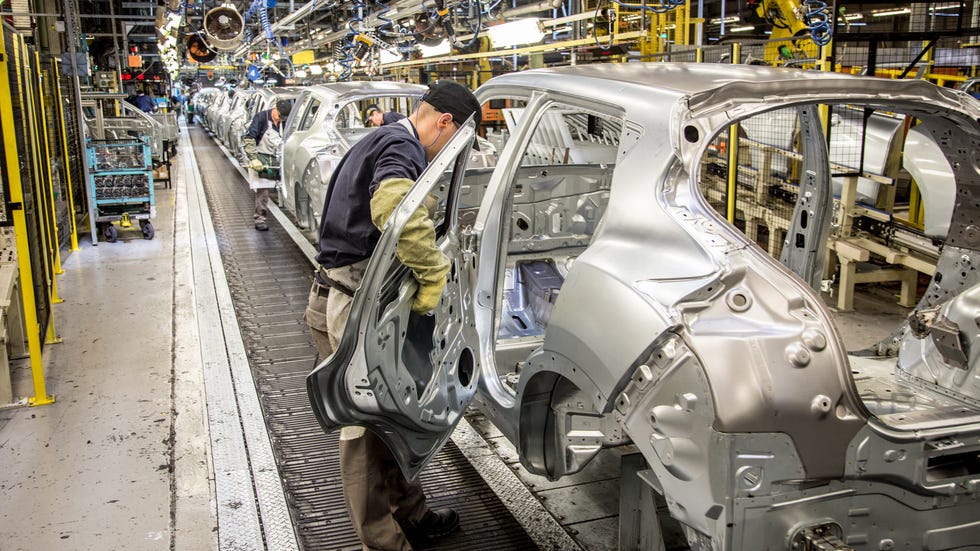
This screenshot has width=980, height=551. I want to click on light, so click(514, 34), click(427, 51).